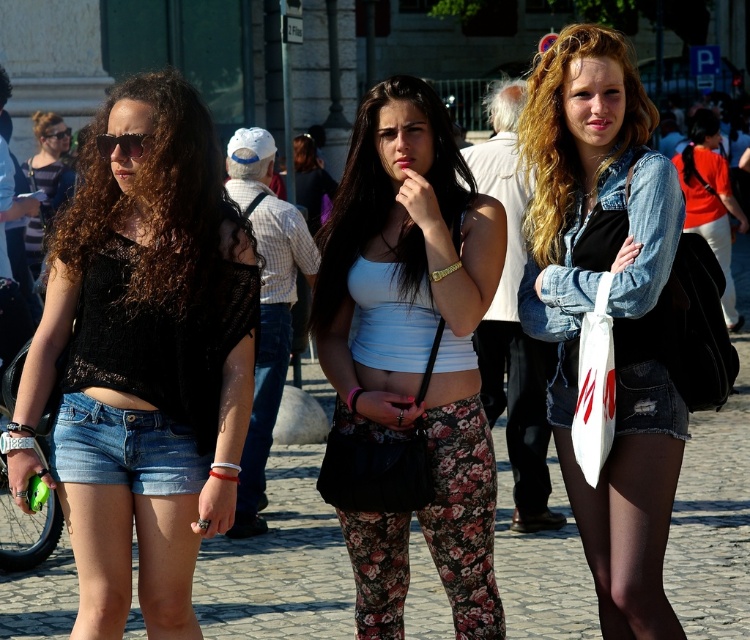
This screenshot has height=640, width=750. What are the coordinates of `white matte tank top at center` in the screenshot? It's located at (410, 360).

Is white matte tank top at center further to camera compared to denim shorts at lower left?

Yes, white matte tank top at center is behind denim shorts at lower left.

Is point (387, 508) positioned before point (86, 429)?

That is False.

At what (x,y) coordinates should I click in order to perform the action: click on white matte tank top at center. Please return your answer as a coordinate pair (x, y). Looking at the image, I should click on (410, 360).

Between black mesh top at center and white matte tank top at center, which one has more height?

white matte tank top at center is taller.

Does point (64, 376) come farther from viewer compared to point (436, 493)?

No, it is not.

Identify the location of black mesh top at center. The width and height of the screenshot is (750, 640). (142, 356).

Does point (142, 492) come farther from viewer compared to point (104, 202)?

No, (142, 492) is closer to viewer.

At what (x,y) coordinates should I click in order to perform the action: click on black mesh top at center. Please return your answer as a coordinate pair (x, y). Image resolution: width=750 pixels, height=640 pixels. Looking at the image, I should click on (142, 356).